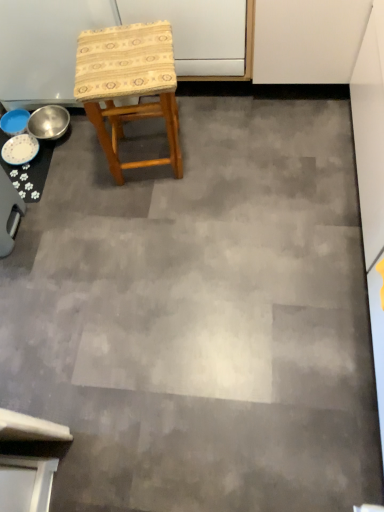
Where is `vacant space in front of blue glossy bowls at left`? vacant space in front of blue glossy bowls at left is located at coordinates (54, 222).